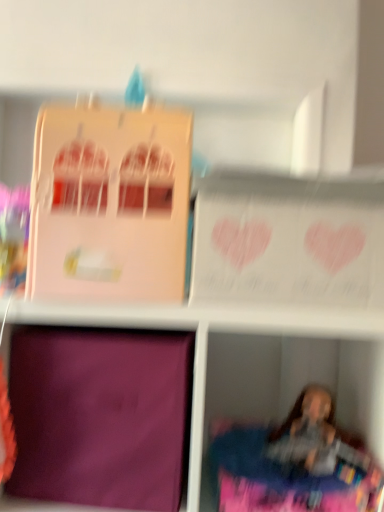
Question: From their relative heights in the image, would you say purple matte cardboard box at lower left, the 2th cardboard box when ordered from top to bottom, is taller or shorter than pink matte cardboard box at upper left, the 1th cardboard box positioned from the top?

Choices:
 (A) tall
 (B) short

Answer: (B)

Question: From the image's perspective, is purple matte cardboard box at lower left, the 1th cardboard box from the bottom, located above or below pink matte cardboard box at upper left, the 1th cardboard box positioned from the top?

Choices:
 (A) below
 (B) above

Answer: (A)

Question: Which object is the closest to the purple fabric at lower left?

Choices:
 (A) pink matte cardboard box at upper left, the 1th cardboard box positioned from the top
 (B) purple matte cardboard box at lower left, the 2th cardboard box when ordered from top to bottom

Answer: (B)

Question: Which object is positioned closest to the pink matte cardboard box at upper left, the 1th cardboard box positioned from the top?

Choices:
 (A) purple matte cardboard box at lower left, the 1th cardboard box from the bottom
 (B) purple fabric at lower left

Answer: (A)